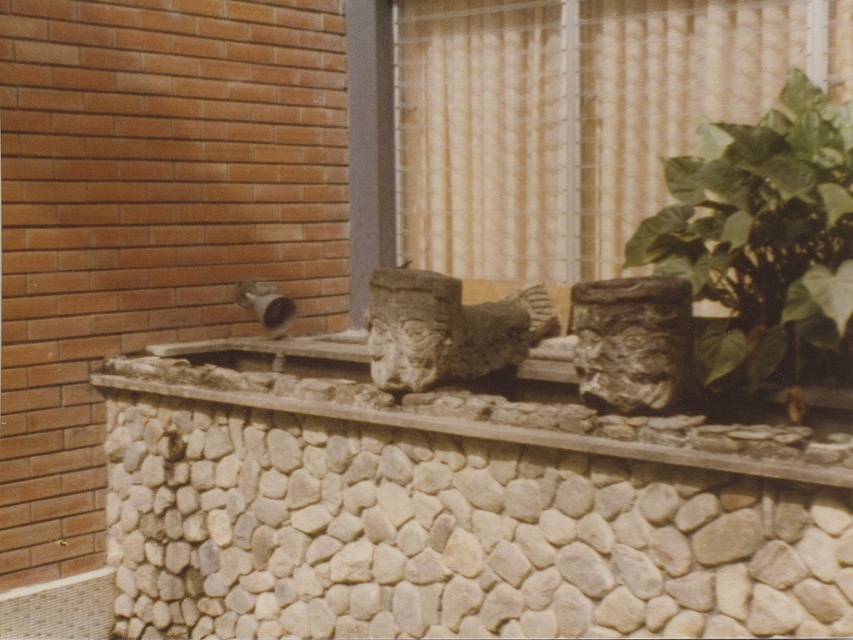
Consider the image. Is green leafy plant at right smaller than matte stone wall at center?

Yes.

Can you confirm if green leafy plant at right is positioned below matte stone wall at center?

No, green leafy plant at right is not below matte stone wall at center.

Where is `green leafy plant at right`? The image size is (853, 640). green leafy plant at right is located at coordinates (764, 237).

Does matte glass window at center have a smaller size compared to matte stone wall at center?

Incorrect, matte glass window at center is not smaller in size than matte stone wall at center.

Can you confirm if matte glass window at center is wider than matte stone wall at center?

No.

Who is more forward, (x=421, y=220) or (x=560, y=435)?

Point (x=560, y=435)

This screenshot has height=640, width=853. Find the location of `matte glass window at center`. matte glass window at center is located at coordinates (555, 124).

Is the position of matte glass window at center more distant than that of green leafy plant at right?

Yes, matte glass window at center is further from the viewer.

Can you confirm if matte glass window at center is positioned to the left of green leafy plant at right?

Yes, matte glass window at center is to the left of green leafy plant at right.

Which is behind, point (415, 148) or point (663, 221)?

Positioned behind is point (415, 148).

The image size is (853, 640). Identify the location of matte glass window at center. (555, 124).